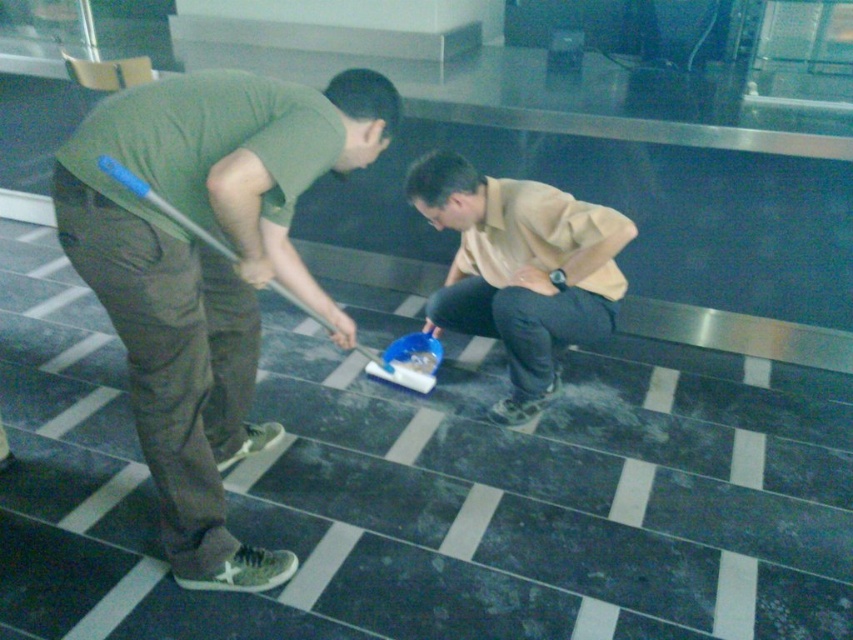
Question: Does green matte shirt at center come behind beige cotton shirt at center?

Choices:
 (A) no
 (B) yes

Answer: (A)

Question: Observing the image, what is the correct spatial positioning of green matte shirt at center in reference to beige cotton shirt at center?

Choices:
 (A) below
 (B) above

Answer: (A)

Question: Which of the following is the closest to the observer?

Choices:
 (A) beige cotton shirt at center
 (B) green matte shirt at center

Answer: (B)

Question: Is green matte shirt at center bigger than beige cotton shirt at center?

Choices:
 (A) yes
 (B) no

Answer: (A)